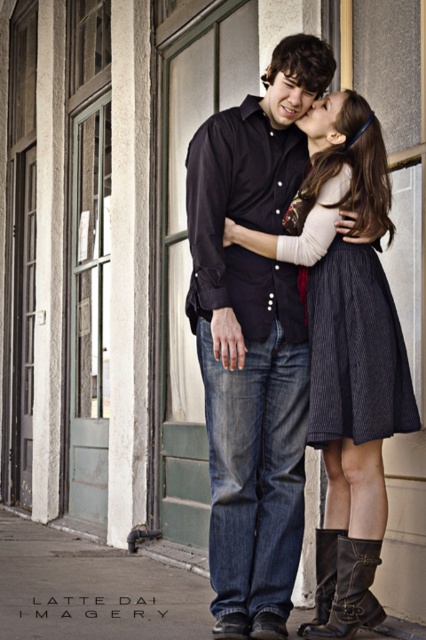
Based on the scene described, which clothing item at the center has a greater width? The matte black shirt at center or the dark pinstriped skirt at center?

The matte black shirt at center might be wider than dark pinstriped skirt at center according to the description.

You are a fashion designer observing this scene. You need to place a decorative pin on the matte black shirt at center so that it aligns with the black leather boot at lower right. Given the distance between them, what is the minimum length of the pin you should choose to ensure it reaches from the shirt to the boot?

The minimum length of the pin should be at least 58.56 centimeters to ensure it can reach from the matte black shirt at center to the black leather boot at lower right.

You are a fashion designer observing the scene. You need to determine which item has a greater horizontal span when viewed from the front. Which one is wider between the dark pinstriped skirt at center and the brown leather boot at lower center?

The dark pinstriped skirt at center is wider than the brown leather boot at lower center according to the description provided.